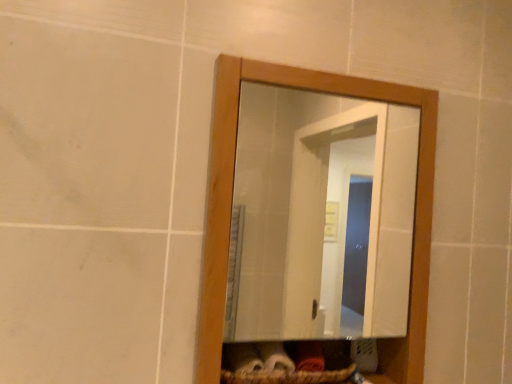
Question: Does wooden mirror at center have a greater width compared to brown woven basket at lower center?

Choices:
 (A) yes
 (B) no

Answer: (B)

Question: Is the position of wooden mirror at center less distant than that of brown woven basket at lower center?

Choices:
 (A) yes
 (B) no

Answer: (A)

Question: Is wooden mirror at center shorter than brown woven basket at lower center?

Choices:
 (A) no
 (B) yes

Answer: (A)

Question: Is wooden mirror at center facing away from brown woven basket at lower center?

Choices:
 (A) yes
 (B) no

Answer: (A)

Question: Is wooden mirror at center facing towards brown woven basket at lower center?

Choices:
 (A) yes
 (B) no

Answer: (A)

Question: From the image's perspective, is wooden mirror at center over brown woven basket at lower center?

Choices:
 (A) yes
 (B) no

Answer: (A)

Question: From a real-world perspective, is brown woven basket at lower center on top of wooden mirror at center?

Choices:
 (A) no
 (B) yes

Answer: (A)

Question: Considering the relative sizes of brown woven basket at lower center and wooden mirror at center in the image provided, is brown woven basket at lower center taller than wooden mirror at center?

Choices:
 (A) yes
 (B) no

Answer: (B)

Question: Is brown woven basket at lower center to the right of wooden mirror at center from the viewer's perspective?

Choices:
 (A) no
 (B) yes

Answer: (A)

Question: Could wooden mirror at center be considered to be inside brown woven basket at lower center?

Choices:
 (A) yes
 (B) no

Answer: (B)

Question: Is brown woven basket at lower center positioned in front of wooden mirror at center?

Choices:
 (A) yes
 (B) no

Answer: (B)

Question: Considering the relative sizes of brown woven basket at lower center and wooden mirror at center in the image provided, is brown woven basket at lower center smaller than wooden mirror at center?

Choices:
 (A) yes
 (B) no

Answer: (A)

Question: Is wooden mirror at center spatially inside brown woven basket at lower center, or outside of it?

Choices:
 (A) inside
 (B) outside

Answer: (B)